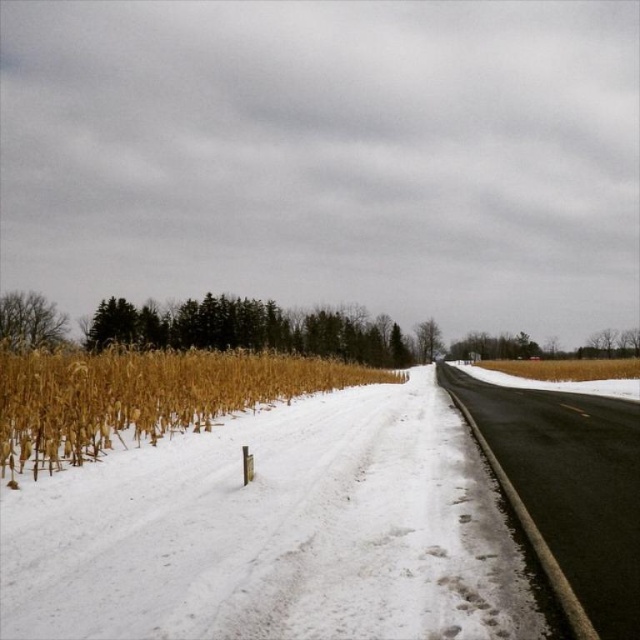
Question: Which is farther from the bare branches at left?

Choices:
 (A) golden dry corn at left
 (B) green leafy tree at center
 (C) black asphalt highway at center

Answer: (C)

Question: Among these objects, which one is nearest to the camera?

Choices:
 (A) golden dry corn at left
 (B) bare branches at left

Answer: (A)

Question: Which point is farther to the camera?

Choices:
 (A) (428, 320)
 (B) (554, 476)
 (C) (356, 378)
 (D) (44, 332)

Answer: (A)

Question: From the image, what is the correct spatial relationship of black asphalt highway at center in relation to green leafy tree at center?

Choices:
 (A) below
 (B) above

Answer: (A)

Question: Observing the image, what is the correct spatial positioning of black asphalt highway at center in reference to bare branches at left?

Choices:
 (A) right
 (B) left

Answer: (A)

Question: Is bare branches at left wider than green leafy tree at center?

Choices:
 (A) yes
 (B) no

Answer: (A)